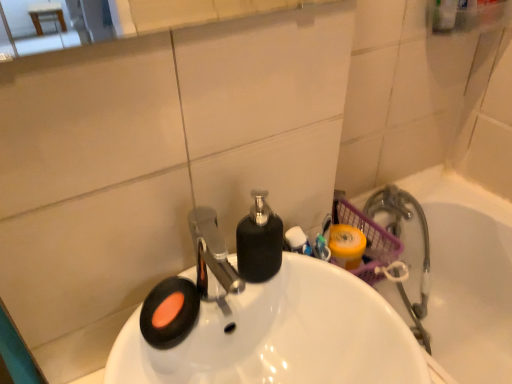
Question: Based on their sizes in the image, would you say white glossy sink at center is bigger or smaller than translucent plastic basket at right?

Choices:
 (A) big
 (B) small

Answer: (B)

Question: Is white glossy sink at center inside the boundaries of translucent plastic basket at right, or outside?

Choices:
 (A) inside
 (B) outside

Answer: (B)

Question: From a real-world perspective, is white glossy sink at center positioned above or below translucent plastic basket at right?

Choices:
 (A) below
 (B) above

Answer: (B)

Question: Is point (401, 223) positioned closer to the camera than point (261, 326)?

Choices:
 (A) closer
 (B) farther

Answer: (B)

Question: From the image's perspective, is translucent plastic basket at right located above or below white glossy sink at center?

Choices:
 (A) above
 (B) below

Answer: (B)

Question: Choose the correct answer: Is translucent plastic basket at right inside white glossy sink at center or outside it?

Choices:
 (A) outside
 (B) inside

Answer: (A)

Question: From a real-world perspective, is translucent plastic basket at right above or below white glossy sink at center?

Choices:
 (A) below
 (B) above

Answer: (A)